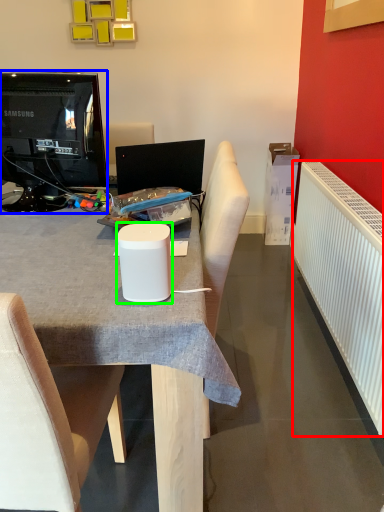
Question: Considering the real-world distances, which object is farthest from radiator (highlighted by a red box)? television (highlighted by a blue box) or paper cup (highlighted by a green box)?

Choices:
 (A) television
 (B) paper cup

Answer: (A)